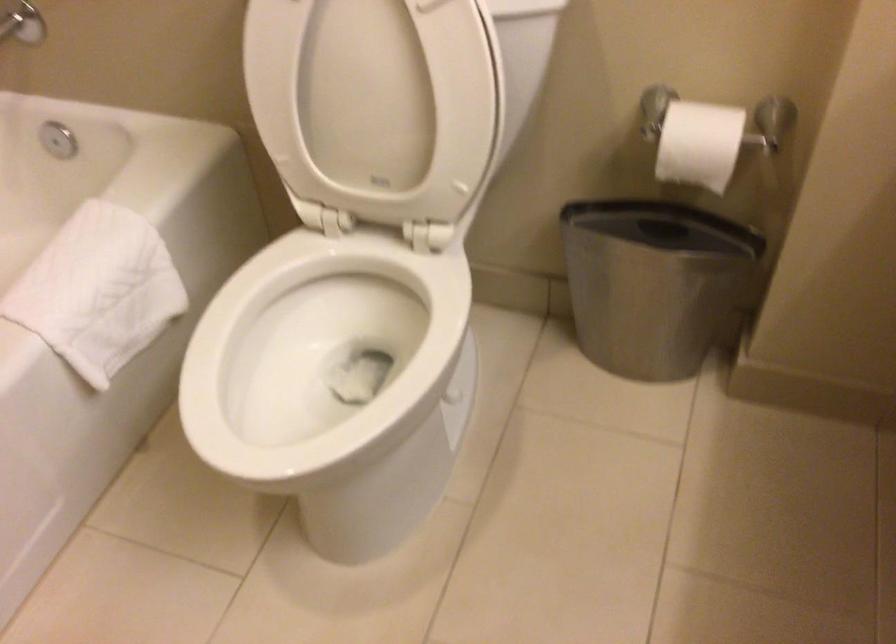
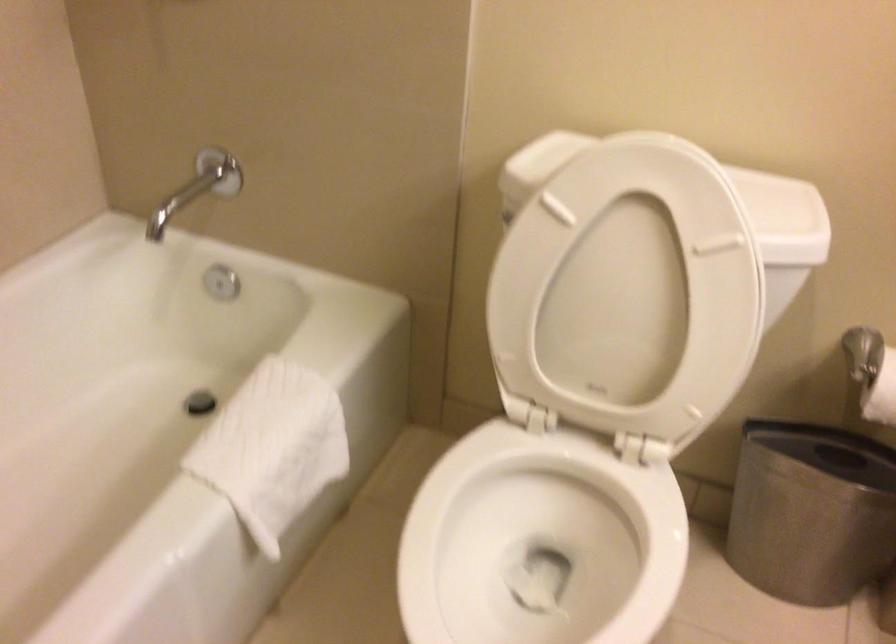
Question: Which direction would the cameraman need to move to produce the second image? Reply with the corresponding letter.

Choices:
 (A) Left
 (B) Right
 (C) Forward
 (D) Backward

Answer: (A)